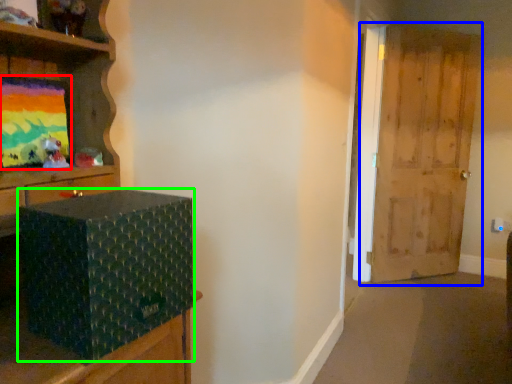
Question: Considering the real-world distances, which object is farthest from picture frame (highlighted by a red box)? door (highlighted by a blue box) or box (highlighted by a green box)?

Choices:
 (A) door
 (B) box

Answer: (A)